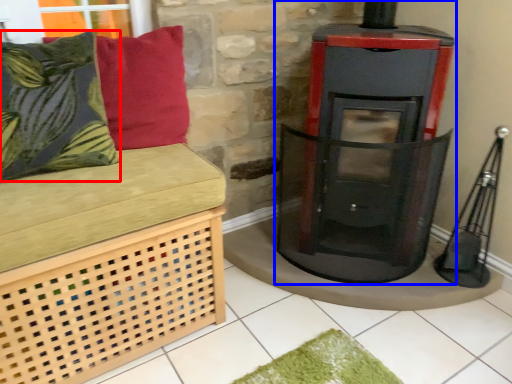
Question: Which object appears closest to the camera in this image, pillow (highlighted by a red box) or wood burning stove (highlighted by a blue box)?

Choices:
 (A) pillow
 (B) wood burning stove

Answer: (A)